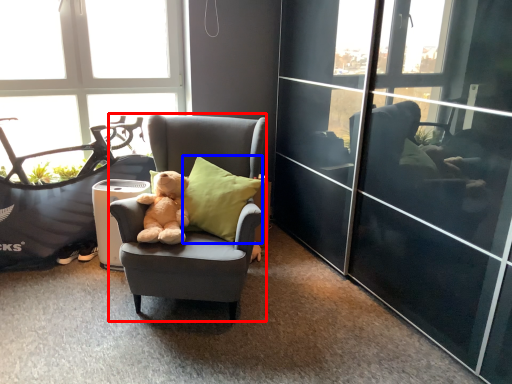
Question: Among these objects, which one is nearest to the camera, chair (highlighted by a red box) or pillow (highlighted by a blue box)?

Choices:
 (A) chair
 (B) pillow

Answer: (A)